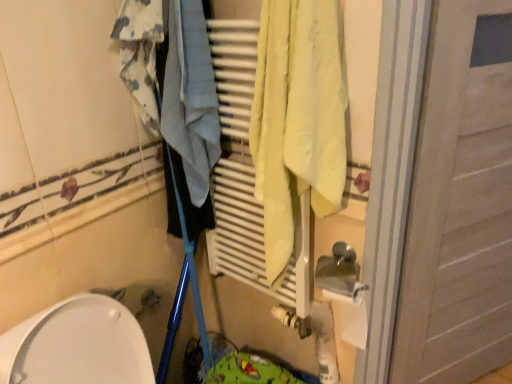
Question: Is blue printed fabric at upper left wider or thinner than white wooden door at right?

Choices:
 (A) thin
 (B) wide

Answer: (B)

Question: Considering the positions of blue printed fabric at upper left and white wooden door at right in the image, is blue printed fabric at upper left bigger or smaller than white wooden door at right?

Choices:
 (A) small
 (B) big

Answer: (A)

Question: In the image, is blue printed fabric at upper left positioned in front of or behind white wooden door at right?

Choices:
 (A) behind
 (B) front

Answer: (A)

Question: Is white wooden door at right spatially inside blue printed fabric at upper left, or outside of it?

Choices:
 (A) outside
 (B) inside

Answer: (A)

Question: From the image's perspective, is white wooden door at right located above or below blue printed fabric at upper left?

Choices:
 (A) above
 (B) below

Answer: (B)

Question: In terms of size, does white wooden door at right appear bigger or smaller than blue printed fabric at upper left?

Choices:
 (A) small
 (B) big

Answer: (B)

Question: Considering the positions of point (465, 201) and point (154, 72), is point (465, 201) closer or farther from the camera than point (154, 72)?

Choices:
 (A) closer
 (B) farther

Answer: (B)